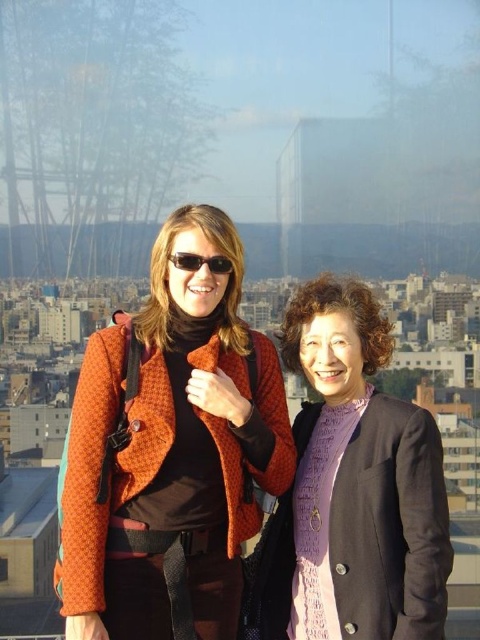
Which is above, purple knitted scarf at center or matte black sunglasses at center?

matte black sunglasses at center

Who is more forward, (385, 452) or (190, 260)?

Point (385, 452) is in front.

What are the coordinates of `purple knitted scarf at center` in the screenshot? It's located at (354, 488).

How distant is orange textured jacket at left from matte black sunglasses at center?

They are 40.99 meters apart.

Is point (230, 480) in front of point (178, 259)?

Yes.

Who is more forward, (255, 365) or (184, 260)?

Point (255, 365)

You are a GUI agent. You are given a task and a screenshot of the screen. Output one action in this format:
    pyautogui.click(x=<x>, y=<y>)
    Task: Click on the orange textured jacket at left
    Image resolution: width=480 pixels, height=640 pixels.
    Given the screenshot: What is the action you would take?
    pyautogui.click(x=170, y=451)

Is orange textured jacket at left to the left of purple knitted scarf at center from the viewer's perspective?

Yes, orange textured jacket at left is to the left of purple knitted scarf at center.

Is point (79, 611) positioned before point (348, 360)?

Yes, it is in front of point (348, 360).

Does point (256, 392) come in front of point (417, 442)?

No, it is not.

The height and width of the screenshot is (640, 480). Identify the location of orange textured jacket at left. (170, 451).